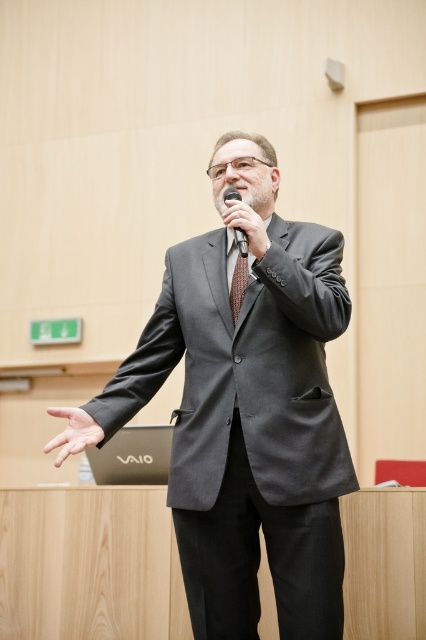
Is brown textured tie at center bigger than black plastic microphone at upper center?

No.

Does brown textured tie at center have a greater width compared to black plastic microphone at upper center?

No, brown textured tie at center is not wider than black plastic microphone at upper center.

What do you see at coordinates (238, 285) in the screenshot? I see `brown textured tie at center` at bounding box center [238, 285].

Identify the location of brown textured tie at center. (238, 285).

From the picture: Who is more forward, [317,440] or [58,436]?

Point [317,440] is in front.

Between matte gray suit at center and smooth skin hand at center, which one is positioned lower?

smooth skin hand at center is lower down.

Image resolution: width=426 pixels, height=640 pixels. In order to click on matte gray suit at center in this screenshot , I will do `click(250, 406)`.

This screenshot has width=426, height=640. I want to click on matte gray suit at center, so click(x=250, y=406).

Can you confirm if matte gray suit at center is smaller than brown textured tie at center?

Actually, matte gray suit at center might be larger than brown textured tie at center.

Is matte gray suit at center positioned in front of brown textured tie at center?

Yes, it is in front of brown textured tie at center.

Is point (207, 362) closer to camera compared to point (244, 257)?

No, it is behind (244, 257).

Find the location of a particular element. This screenshot has width=426, height=640. matte gray suit at center is located at coordinates (250, 406).